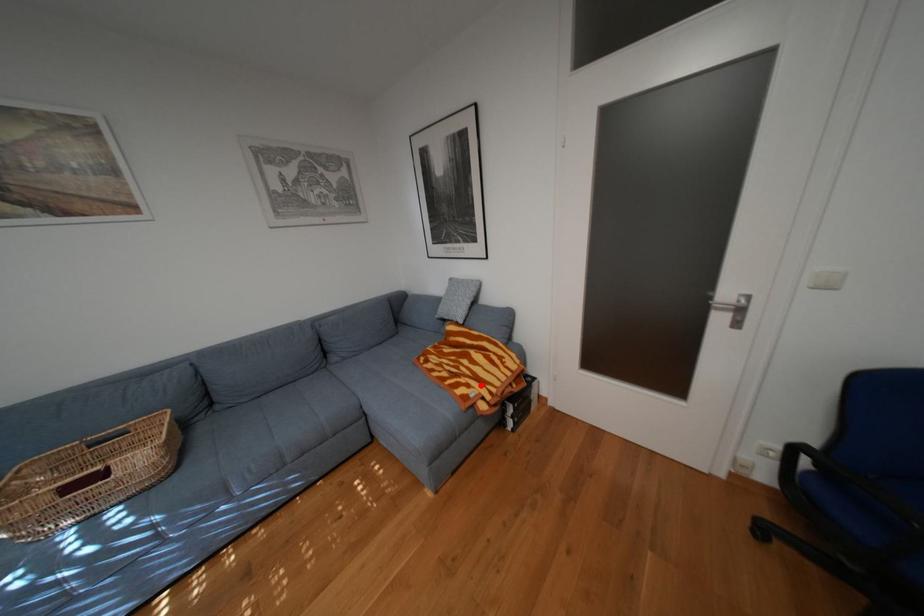
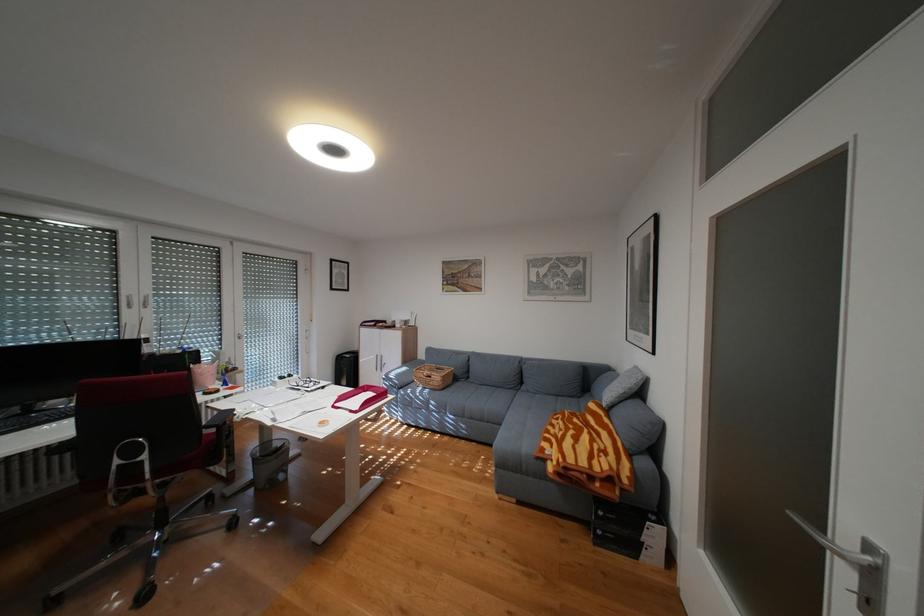
Question: I am providing you with two images of the same scene from different viewpoints. In image1, a red point is highlighted. Considering the same 3D point in image2, which of the following is correct?

Choices:
 (A) It is closer
 (B) It is farther

Answer: (A)